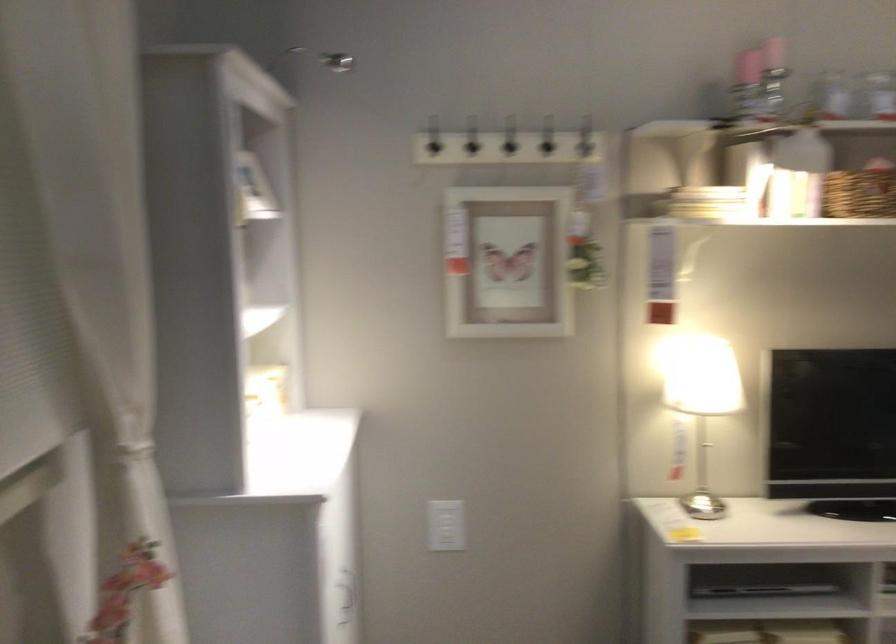
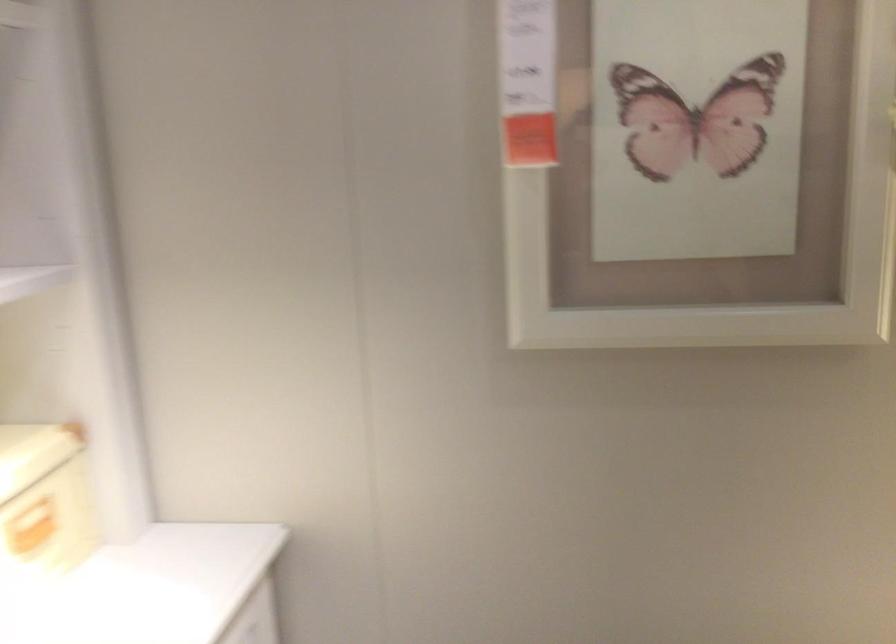
Question: Which direction would the cameraman need to move to produce the second image? Reply with the corresponding letter.

Choices:
 (A) Left
 (B) Right
 (C) Forward
 (D) Backward

Answer: (C)